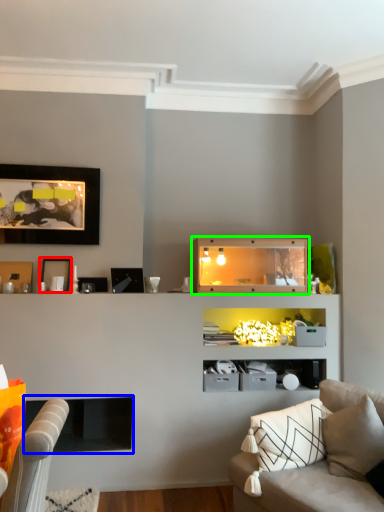
Question: Which is farther away from picture frame (highlighted by a red box)? fireplace (highlighted by a blue box) or shelf (highlighted by a green box)?

Choices:
 (A) fireplace
 (B) shelf

Answer: (B)